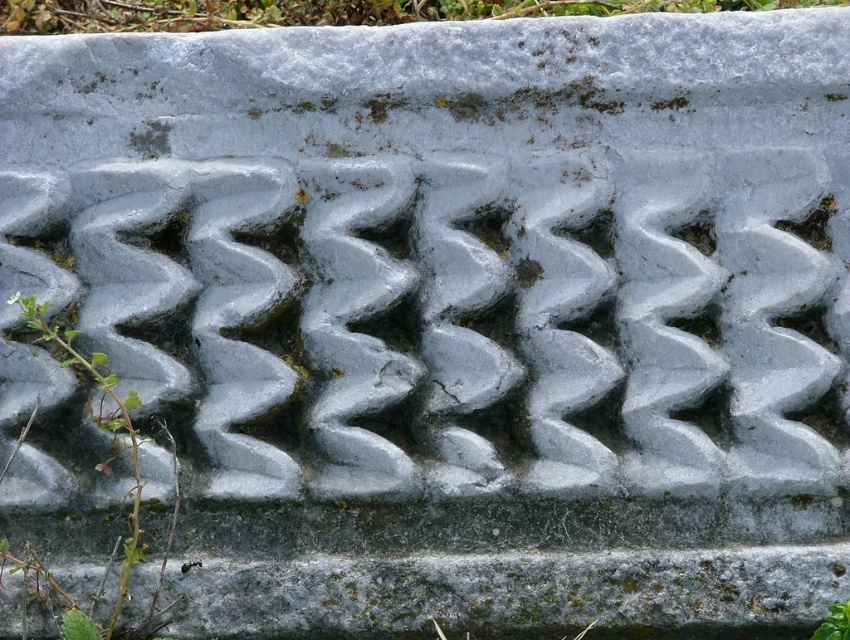
You are a gardener looking at the stone structure. You notice the green grass at upper center and the green leafy weed at left. Which one is closer to you?

The green grass at upper center is closer to you because the green leafy weed at left is behind it.

You are a gardener who wants to remove weeds from the stone structure. You have a tool that can reach 12 inches. Can you reach the green leafy weed at left from the green grass at upper center without moving the tool?

The green grass at upper center is 13.04 inches from the green leafy weed at left. Since the tool can only reach 12 inches, you cannot reach the green leafy weed at left from the green grass at upper center without moving the tool.